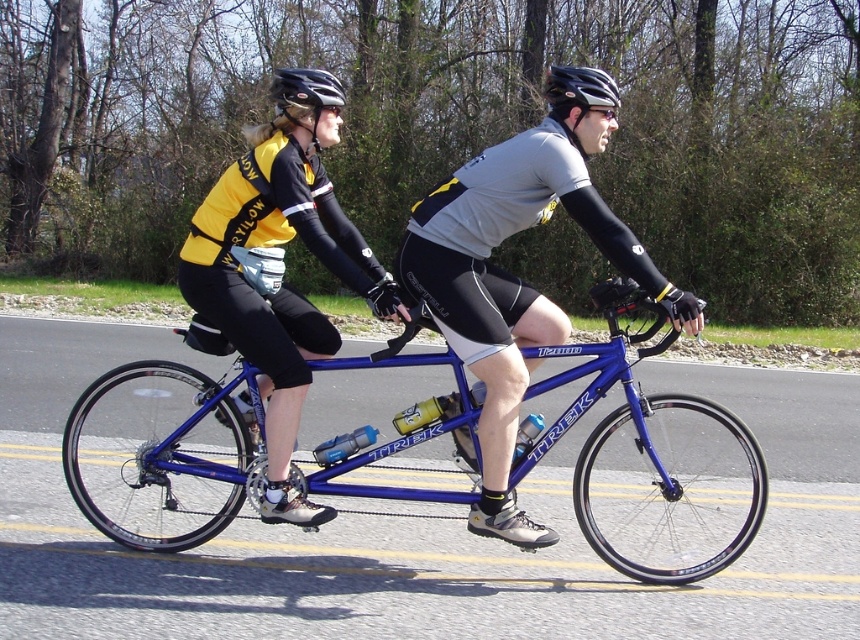
Question: Can you confirm if blue metallic bicycle at center is positioned above black matte helmet at center?

Choices:
 (A) yes
 (B) no

Answer: (B)

Question: Which of the following is the closest to the observer?

Choices:
 (A) (602, 108)
 (B) (123, 401)
 (C) (609, 80)

Answer: (A)

Question: Is blue metallic bicycle at center closer to the viewer compared to matte blue bicycle at center?

Choices:
 (A) yes
 (B) no

Answer: (B)

Question: Which object appears closest to the camera in this image?

Choices:
 (A) matte blue bicycle at center
 (B) black matte helmet at center
 (C) black matte helmet at upper center

Answer: (A)

Question: Which point is closer to the camera taking this photo?

Choices:
 (A) (666, 442)
 (B) (275, 84)
 (C) (564, 113)
 (D) (507, 280)

Answer: (C)

Question: Is matte blue bicycle at center in front of black matte helmet at upper center?

Choices:
 (A) no
 (B) yes

Answer: (B)